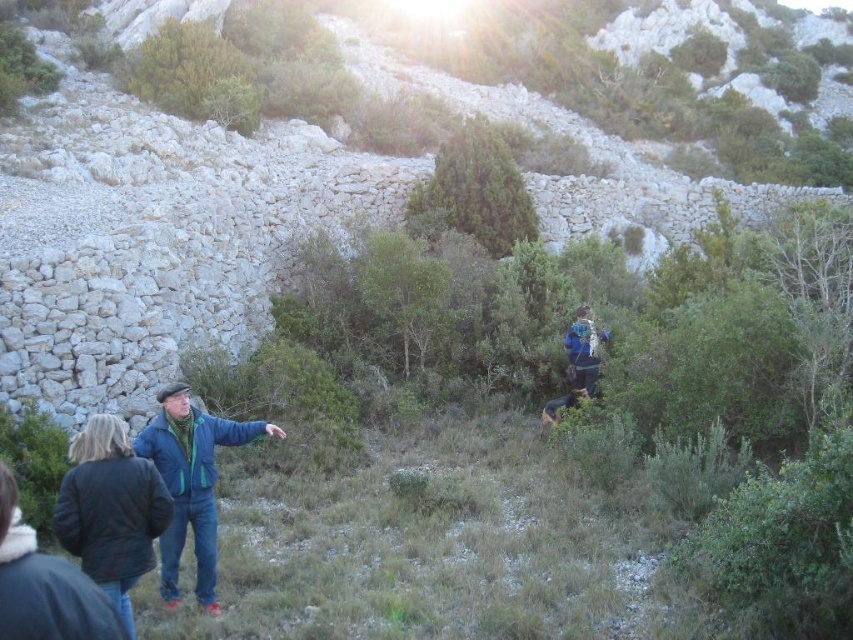
You are trying to decide which jacket to take for a hike. You see both the dark blue jacket at lower left and the blue denim jacket at lower left. Which one is thinner?

The dark blue jacket at lower left is thinner than the blue denim jacket at lower left.

You are a photographer trying to capture both the dark blue jacket at lower left and the blue denim jacket at lower left in a single shot. Since you want to ensure both are visible, which jacket should you focus on first to avoid missing one due to their height difference?

The dark blue jacket at lower left has a lesser height compared to the blue denim jacket at lower left. To ensure both are visible, focus on the darker jacket first as it is shorter and might be obscured if the taller denim jacket is in front.

You are standing at the center of the image and want to locate the dark blue jacket at lower left. According to the coordinates, in which direction should you look to find it?

The dark blue jacket at lower left is located at coordinates point (109, 509), so you should look to the lower left direction to find it.